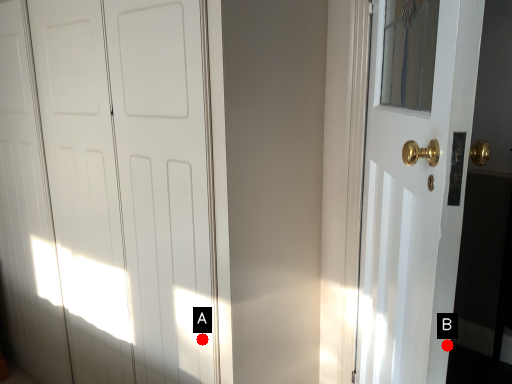
Question: Two points are circled on the image, labeled by A and B beside each circle. Which point appears closest to the camera in this image?

Choices:
 (A) A is closer
 (B) B is closer

Answer: (B)